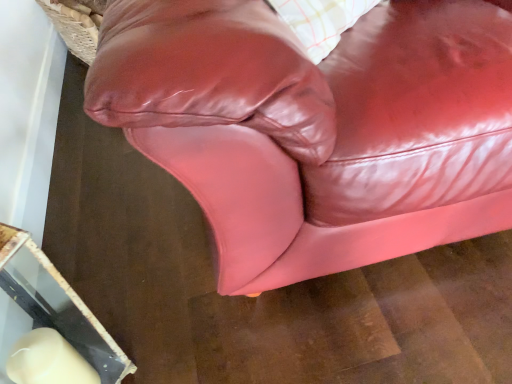
Question: Is glossy leather couch at center in front of or behind glossy leather pillow at upper center in the image?

Choices:
 (A) front
 (B) behind

Answer: (B)

Question: Choose the correct answer: Is glossy leather couch at center inside glossy leather pillow at upper center or outside it?

Choices:
 (A) outside
 (B) inside

Answer: (A)

Question: Would you say glossy leather couch at center is to the left or to the right of glossy leather pillow at upper center in the picture?

Choices:
 (A) left
 (B) right

Answer: (A)

Question: From the image's perspective, is glossy leather pillow at upper center positioned above or below glossy leather couch at center?

Choices:
 (A) below
 (B) above

Answer: (B)

Question: In terms of width, does glossy leather pillow at upper center look wider or thinner when compared to glossy leather couch at center?

Choices:
 (A) thin
 (B) wide

Answer: (A)

Question: Considering the positions of glossy leather pillow at upper center and glossy leather couch at center in the image, is glossy leather pillow at upper center taller or shorter than glossy leather couch at center?

Choices:
 (A) tall
 (B) short

Answer: (A)

Question: Considering the positions of point (311, 130) and point (417, 175), is point (311, 130) closer or farther from the camera than point (417, 175)?

Choices:
 (A) farther
 (B) closer

Answer: (B)